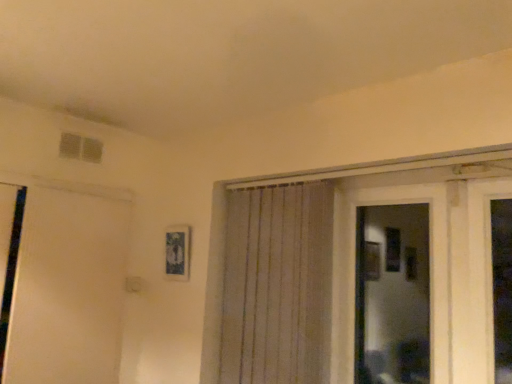
Question: From a real-world perspective, does white matte door at left sit lower than white textured curtain at center?

Choices:
 (A) yes
 (B) no

Answer: (A)

Question: Does white matte door at left have a greater height compared to white textured curtain at center?

Choices:
 (A) no
 (B) yes

Answer: (B)

Question: Are white matte door at left and white textured curtain at center beside each other?

Choices:
 (A) yes
 (B) no

Answer: (B)

Question: Does white matte door at left have a smaller size compared to white textured curtain at center?

Choices:
 (A) yes
 (B) no

Answer: (B)

Question: Is white matte door at left to the right of white textured curtain at center from the viewer's perspective?

Choices:
 (A) no
 (B) yes

Answer: (A)

Question: Does white matte door at left come behind white textured curtain at center?

Choices:
 (A) yes
 (B) no

Answer: (A)

Question: From the image's perspective, would you say white textured curtain at center is positioned over white matte door at left?

Choices:
 (A) no
 (B) yes

Answer: (B)

Question: Is white matte door at left at the back of white textured curtain at center?

Choices:
 (A) no
 (B) yes

Answer: (A)

Question: From a real-world perspective, is white textured curtain at center physically above white matte door at left?

Choices:
 (A) no
 (B) yes

Answer: (B)

Question: Is white textured curtain at center in front of white matte door at left?

Choices:
 (A) no
 (B) yes

Answer: (B)

Question: Is white textured curtain at center at the right side of white matte door at left?

Choices:
 (A) no
 (B) yes

Answer: (B)

Question: Considering the relative sizes of white textured curtain at center and white matte door at left in the image provided, is white textured curtain at center taller than white matte door at left?

Choices:
 (A) yes
 (B) no

Answer: (B)

Question: Could you tell me if white textured curtain at center is facing transparent glass door at center?

Choices:
 (A) yes
 (B) no

Answer: (B)